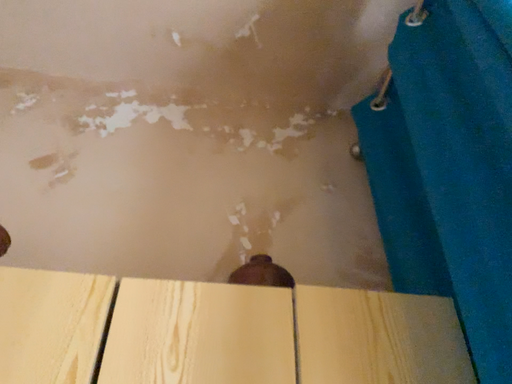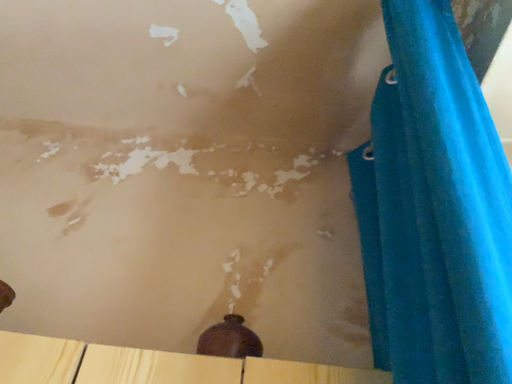
Question: Which way did the camera rotate in the video?

Choices:
 (A) rotated right
 (B) rotated left

Answer: (B)